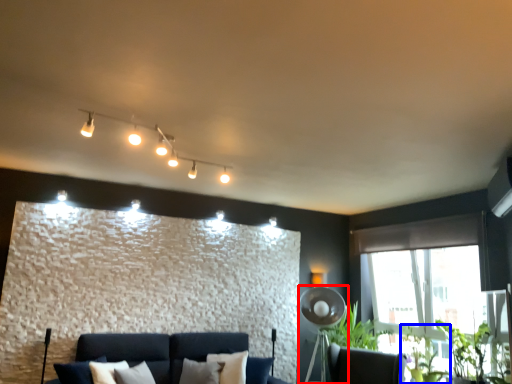
Question: Which point is closer to the camera, fan (highlighted by a red box) or plant (highlighted by a blue box)?

Choices:
 (A) fan
 (B) plant

Answer: (B)